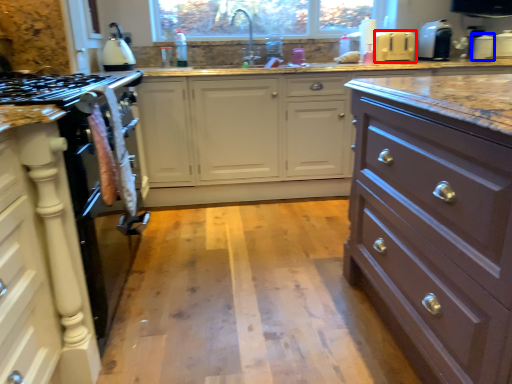
Question: Which point is further to the camera, appliance (highlighted by a red box) or appliance (highlighted by a blue box)?

Choices:
 (A) appliance
 (B) appliance

Answer: (B)